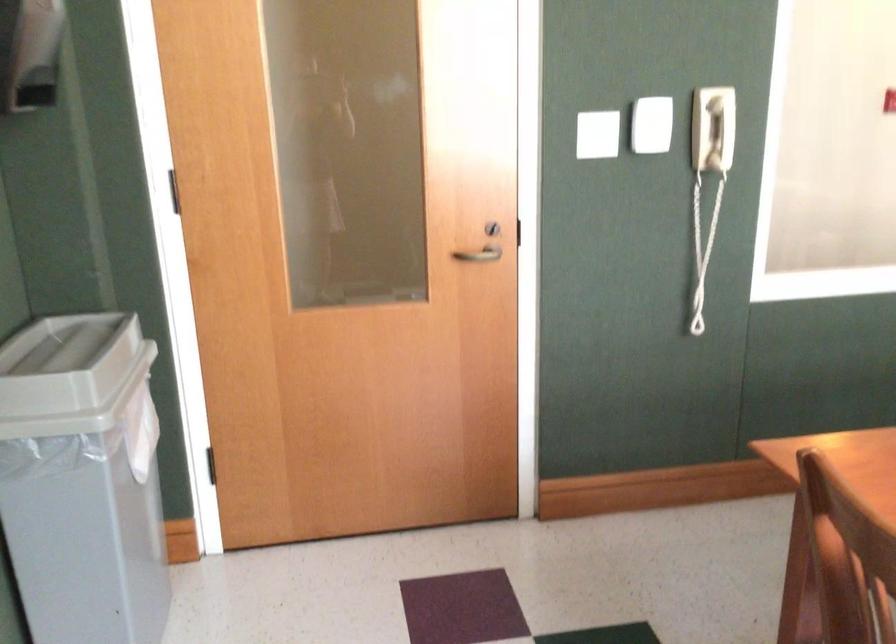
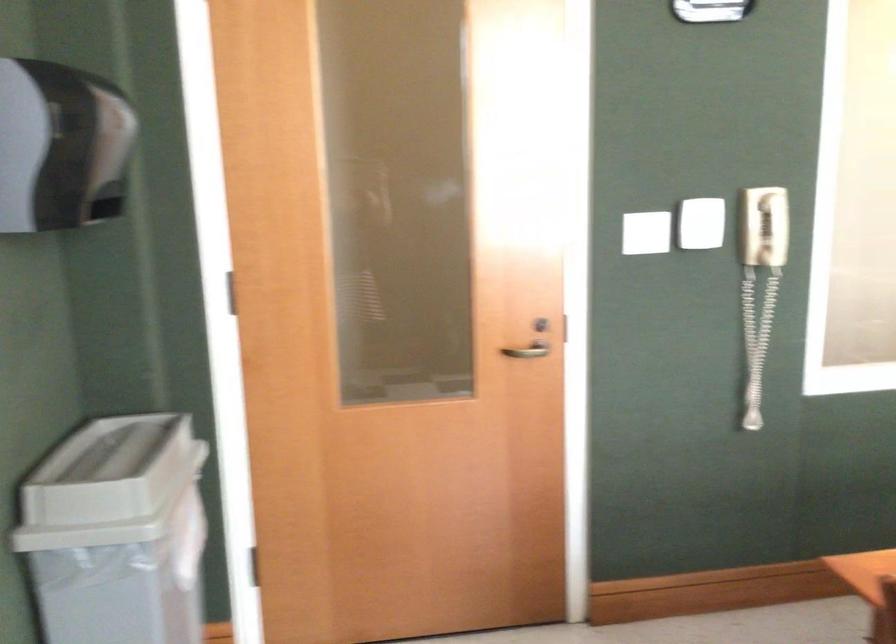
The images are taken continuously from a first-person perspective. In which direction are you moving?

The movement direction of the cameraman is left, forward.